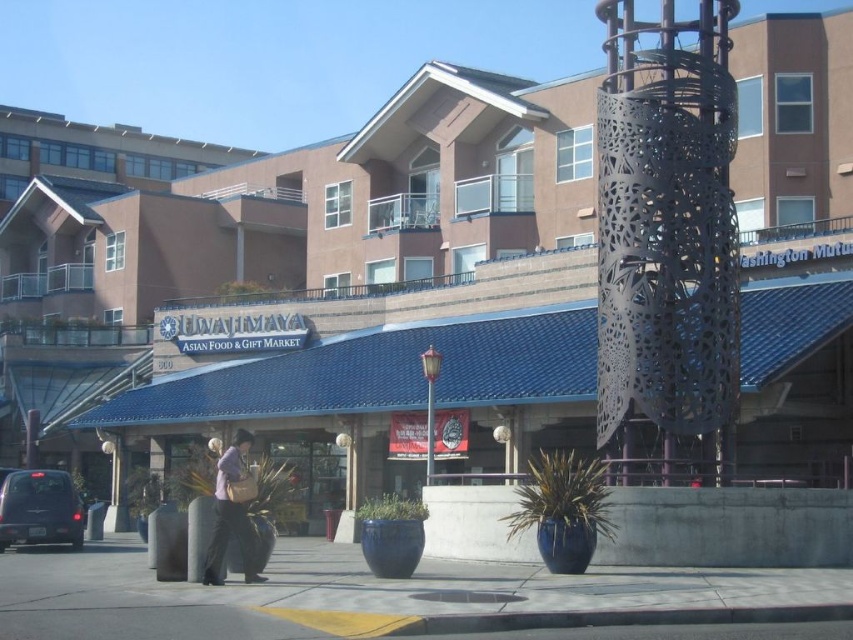
Question: Does black perforated metal tower at center have a greater width compared to gray concrete pavement at lower center?

Choices:
 (A) no
 (B) yes

Answer: (A)

Question: Among these objects, which one is farthest from the camera?

Choices:
 (A) black perforated metal tower at center
 (B) matte black van at lower left
 (C) light purple fabric bag at lower center
 (D) gray concrete pavement at lower center

Answer: (B)

Question: In this image, where is gray concrete pavement at lower center located relative to matte black van at lower left?

Choices:
 (A) above
 (B) below

Answer: (B)

Question: In this image, where is gray concrete pavement at lower center located relative to matte black van at lower left?

Choices:
 (A) left
 (B) right

Answer: (B)

Question: Which of the following is the farthest from the observer?

Choices:
 (A) black perforated metal tower at center
 (B) light purple fabric bag at lower center
 (C) gray concrete pavement at lower center
 (D) matte black van at lower left

Answer: (D)

Question: Which point is closer to the camera?

Choices:
 (A) (647, 221)
 (B) (42, 525)
 (C) (428, 595)
 (D) (216, 573)

Answer: (C)